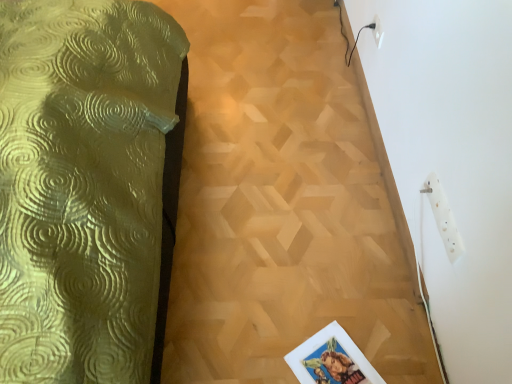
Find the location of `wooden parquet floor at center`. wooden parquet floor at center is located at coordinates (281, 204).

Locate an element on the screen. white plastic electric outlet at upper right, which appears as the 1th electric outlet when viewed from the left is located at coordinates (377, 31).

How much space does white plastic electric outlet at upper right, the second electric outlet in the right-to-left sequence, occupy horizontally?

white plastic electric outlet at upper right, the second electric outlet in the right-to-left sequence, is 0.59 inches in width.

Identify the location of wooden parquet floor at center. The image size is (512, 384). (281, 204).

Would you say wooden parquet floor at center is part of white plastic electric outlet at upper right, which is counted as the 1th electric outlet, starting from the top,'s contents?

No, wooden parquet floor at center is not inside white plastic electric outlet at upper right, which is counted as the 1th electric outlet, starting from the top.

Based on the photo, is white plastic electric outlet at upper right, which is counted as the 1th electric outlet, starting from the top, with wooden parquet floor at center?

They are not placed beside each other.

In the scene shown: Considering the relative sizes of white plastic electric outlet at upper right, which is counted as the 1th electric outlet, starting from the top, and wooden parquet floor at center in the image provided, is white plastic electric outlet at upper right, which is counted as the 1th electric outlet, starting from the top, thinner than wooden parquet floor at center?

Yes.

Between white plastic electric outlet at upper right, the second electric outlet ordered from the bottom, and wooden parquet floor at center, which one is positioned in front?

wooden parquet floor at center.

Between white plastic socket at upper right, the 1th electric outlet in the bottom-to-top sequence, and white plastic electric outlet at upper right, the 2th electric outlet viewed from the front, which one has larger size?

white plastic socket at upper right, the 1th electric outlet in the bottom-to-top sequence.

Which object is thinner, white plastic socket at upper right, the 1th electric outlet in the bottom-to-top sequence, or white plastic electric outlet at upper right, which is counted as the 1th electric outlet, starting from the top?

white plastic electric outlet at upper right, which is counted as the 1th electric outlet, starting from the top, is thinner.

Is point (449, 257) in front of point (376, 22)?

Yes, it is in front of point (376, 22).

Who is more distant, white plastic socket at upper right, the 2th electric outlet from the back, or white plastic electric outlet at upper right, the second electric outlet ordered from the bottom?

white plastic electric outlet at upper right, the second electric outlet ordered from the bottom, is behind.

Would you say white plastic socket at upper right, placed as the first electric outlet when sorted from right to left, is outside wooden parquet floor at center?

That's correct, white plastic socket at upper right, placed as the first electric outlet when sorted from right to left, is outside of wooden parquet floor at center.

Can you tell me how much white plastic socket at upper right, the 1th electric outlet in the bottom-to-top sequence, and wooden parquet floor at center differ in facing direction?

white plastic socket at upper right, the 1th electric outlet in the bottom-to-top sequence, and wooden parquet floor at center are facing 89.7 degrees away from each other.

Measure the distance from white plastic socket at upper right, the 1th electric outlet in the bottom-to-top sequence, to wooden parquet floor at center.

They are 23.55 inches apart.

From a real-world perspective, which is physically above, white plastic socket at upper right, acting as the 2th electric outlet starting from the top, or wooden parquet floor at center?

white plastic socket at upper right, acting as the 2th electric outlet starting from the top, is physically above.

From a real-world perspective, is white plastic electric outlet at upper right, the 2th electric outlet viewed from the front, physically above white plastic socket at upper right, the 1th electric outlet in the front-to-back sequence?

Indeed, from a real-world perspective, white plastic electric outlet at upper right, the 2th electric outlet viewed from the front, stands above white plastic socket at upper right, the 1th electric outlet in the front-to-back sequence.

Is point (373, 21) positioned after point (434, 205)?

Yes.

How many degrees apart are the facing directions of white plastic electric outlet at upper right, the second electric outlet in the right-to-left sequence, and white plastic socket at upper right, placed as the first electric outlet when sorted from right to left?

0.651 degrees.

Is white plastic electric outlet at upper right, which is the first electric outlet in back-to-front order, not within white plastic socket at upper right, the 1th electric outlet in the front-to-back sequence?

Indeed, white plastic electric outlet at upper right, which is the first electric outlet in back-to-front order, is completely outside white plastic socket at upper right, the 1th electric outlet in the front-to-back sequence.

From a real-world perspective, between wooden parquet floor at center and white plastic electric outlet at upper right, the second electric outlet ordered from the bottom, who is vertically lower?

From a 3D spatial view, wooden parquet floor at center is below.

Are wooden parquet floor at center and white plastic electric outlet at upper right, the 2th electric outlet viewed from the front, beside each other?

wooden parquet floor at center is not next to white plastic electric outlet at upper right, the 2th electric outlet viewed from the front, and they're not touching.

Which is more to the left, wooden parquet floor at center or white plastic electric outlet at upper right, which is counted as the 1th electric outlet, starting from the top?

wooden parquet floor at center is more to the left.

What's the angular difference between wooden parquet floor at center and white plastic electric outlet at upper right, the second electric outlet in the right-to-left sequence,'s facing directions?

The facing directions of wooden parquet floor at center and white plastic electric outlet at upper right, the second electric outlet in the right-to-left sequence, are 90.3 degrees apart.

Choose the correct answer: Is wooden parquet floor at center inside white plastic socket at upper right, placed as the second electric outlet when sorted from left to right, or outside it?

wooden parquet floor at center cannot be found inside white plastic socket at upper right, placed as the second electric outlet when sorted from left to right.

Which is behind, point (231, 305) or point (443, 240)?

Point (231, 305)

Are wooden parquet floor at center and white plastic socket at upper right, placed as the first electric outlet when sorted from right to left, beside each other?

No, wooden parquet floor at center is not beside white plastic socket at upper right, placed as the first electric outlet when sorted from right to left.

Can you confirm if wooden parquet floor at center is thinner than white plastic socket at upper right, the 2th electric outlet from the back?

In fact, wooden parquet floor at center might be wider than white plastic socket at upper right, the 2th electric outlet from the back.

The height and width of the screenshot is (384, 512). Find the location of `the 1st electric outlet counting from the right side of the wooden parquet floor at center`. the 1st electric outlet counting from the right side of the wooden parquet floor at center is located at coordinates (377, 31).

At what (x,y) coordinates should I click in order to perform the action: click on electric outlet below the white plastic electric outlet at upper right, which is the first electric outlet in back-to-front order (from the image's perspective). Please return your answer as a coordinate pair (x, y). Image resolution: width=512 pixels, height=384 pixels. Looking at the image, I should click on point(443,217).

When comparing their distances from white plastic electric outlet at upper right, the second electric outlet ordered from the bottom, does wooden parquet floor at center or white plastic socket at upper right, the 1th electric outlet in the front-to-back sequence, seem closer?

wooden parquet floor at center lies closer to white plastic electric outlet at upper right, the second electric outlet ordered from the bottom, than the other object.

Considering their positions, is white plastic electric outlet at upper right, which is the first electric outlet in back-to-front order, positioned closer to wooden parquet floor at center than white plastic socket at upper right, acting as the 2th electric outlet starting from the top?

white plastic socket at upper right, acting as the 2th electric outlet starting from the top.

Considering their positions, is white plastic electric outlet at upper right, the second electric outlet ordered from the bottom, positioned further to white plastic socket at upper right, acting as the 2th electric outlet starting from the top, than wooden parquet floor at center?

white plastic electric outlet at upper right, the second electric outlet ordered from the bottom, is positioned further to the anchor white plastic socket at upper right, acting as the 2th electric outlet starting from the top.

Looking at the image, which one is located closer to wooden parquet floor at center, white plastic socket at upper right, acting as the 2th electric outlet starting from the top, or white plastic electric outlet at upper right, the 2th electric outlet viewed from the front?

white plastic socket at upper right, acting as the 2th electric outlet starting from the top, lies closer to wooden parquet floor at center than the other object.

Which object lies further to the anchor point white plastic socket at upper right, the 1th electric outlet in the bottom-to-top sequence, wooden parquet floor at center or white plastic electric outlet at upper right, the second electric outlet in the right-to-left sequence?

Based on the image, white plastic electric outlet at upper right, the second electric outlet in the right-to-left sequence, appears to be further to white plastic socket at upper right, the 1th electric outlet in the bottom-to-top sequence.

When comparing their distances from white plastic electric outlet at upper right, which appears as the 1th electric outlet when viewed from the left, does white plastic socket at upper right, the 2th electric outlet from the back, or wooden parquet floor at center seem closer?

Based on the image, wooden parquet floor at center appears to be nearer to white plastic electric outlet at upper right, which appears as the 1th electric outlet when viewed from the left.

Locate an element on the screen. This screenshot has height=384, width=512. electric outlet situated between wooden parquet floor at center and white plastic socket at upper right, placed as the second electric outlet when sorted from left to right, from left to right is located at coordinates (377, 31).